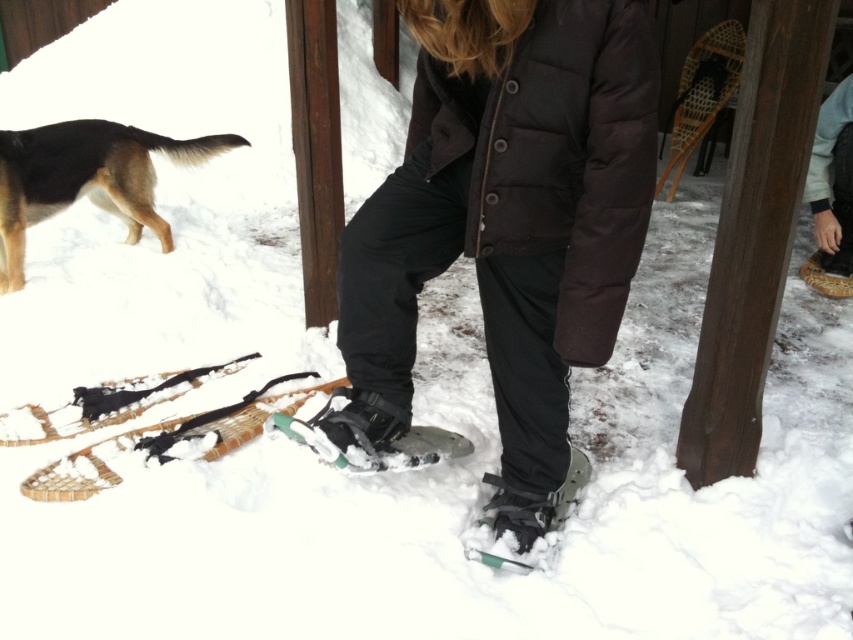
Looking at this image, you are a photographer trying to capture the exact position of the matte black snowshoes at center in this snowy scene. According to the coordinates provided, what are the precise coordinates where the snowshoes are located?

The precise coordinates of the matte black snowshoes at center are at point (506, 221).

You are a photographer trying to capture the person in the scene. You want to focus on the gray fleece jacket at upper right and the green rubber snowshoe at center. Based on their positions, which object should you adjust your camera to focus on first if you want to start with the one closer to the left side?

The green rubber snowshoe at center is to the left of the gray fleece jacket at upper right, so you should focus on the green rubber snowshoe at center first as it is positioned more to the left side.

You are a photographer trying to capture the green rubber snowshoe at center and the gray fleece jacket at upper right in the same frame. Which object should you focus on first to ensure both are in focus?

You should focus on the green rubber snowshoe at center first because it is closer to the viewer than the gray fleece jacket at upper right. By focusing on the closer object, the farther one will also be in focus due to the depth of field.